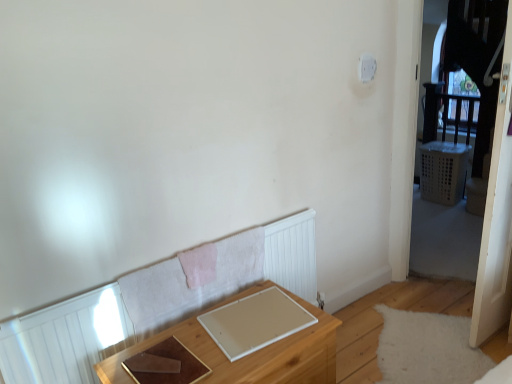
Question: From the image's perspective, is white plastic light switch at upper right beneath wooden table at lower center?

Choices:
 (A) yes
 (B) no

Answer: (B)

Question: Is white plastic light switch at upper right shorter than wooden table at lower center?

Choices:
 (A) no
 (B) yes

Answer: (B)

Question: Does white plastic light switch at upper right have a greater height compared to wooden table at lower center?

Choices:
 (A) yes
 (B) no

Answer: (B)

Question: Can you confirm if white plastic light switch at upper right is positioned to the left of wooden table at lower center?

Choices:
 (A) no
 (B) yes

Answer: (A)

Question: Is white plastic light switch at upper right aimed at wooden table at lower center?

Choices:
 (A) yes
 (B) no

Answer: (B)

Question: Looking at the image, does wooden table at lower center seem bigger or smaller compared to white plastic light switch at upper right?

Choices:
 (A) small
 (B) big

Answer: (B)

Question: Do you think wooden table at lower center is within white plastic light switch at upper right, or outside of it?

Choices:
 (A) outside
 (B) inside

Answer: (A)

Question: Is wooden table at lower center in front of or behind white plastic light switch at upper right in the image?

Choices:
 (A) behind
 (B) front

Answer: (B)

Question: Is wooden table at lower center to the left or to the right of white plastic light switch at upper right in the image?

Choices:
 (A) left
 (B) right

Answer: (A)

Question: In terms of height, does transparent plastic screen door at right look taller or shorter compared to wooden table at lower center?

Choices:
 (A) tall
 (B) short

Answer: (A)

Question: Based on their sizes in the image, would you say transparent plastic screen door at right is bigger or smaller than wooden table at lower center?

Choices:
 (A) big
 (B) small

Answer: (B)

Question: In the image, is transparent plastic screen door at right on the left side or the right side of wooden table at lower center?

Choices:
 (A) right
 (B) left

Answer: (A)

Question: Is transparent plastic screen door at right inside or outside of wooden table at lower center?

Choices:
 (A) inside
 (B) outside

Answer: (B)

Question: Considering the positions of white plastic light switch at upper right and wooden table at lower center in the image, is white plastic light switch at upper right taller or shorter than wooden table at lower center?

Choices:
 (A) tall
 (B) short

Answer: (B)

Question: Is point (362, 71) closer or farther from the camera than point (203, 350)?

Choices:
 (A) farther
 (B) closer

Answer: (A)